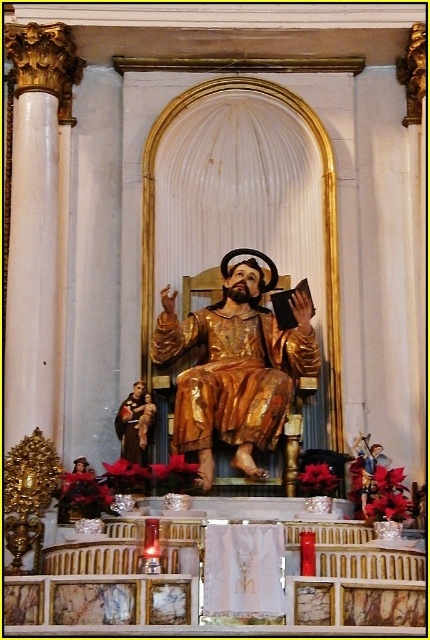
You are standing in front of the altar and want to locate the point at coordinates (236, 365). Based on the description, where exactly on the altar setup would this point be located?

The point at coordinates (236, 365) is on the gold polished statue at center.

You are standing in front of the altar and want to place a small candle exactly at the center of the altar. According to the coordinates provided, where should you place the candle relative to the matte gold statue at center?

The matte gold statue at center is located at point coordinates of (x=135, y=422). Since the altar is the central structure, placing the candle at the center of the altar would mean positioning it near the matte gold statue at center at those coordinates.

You are an art conservator assessing the space between two gold statues on the altar. The first is labeled as the gold polished statue at center and the second as the gold statue at center. Which statue has a greater width according to the description?

The gold polished statue at center is wider than the gold statue at center according to the description.